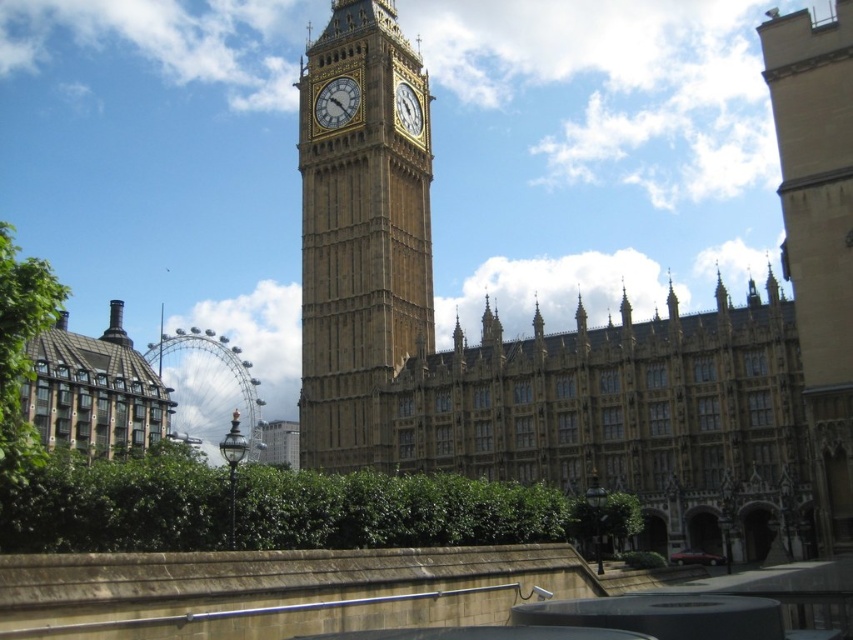
Question: Considering the real-world distances, which object is closest to the golden stone clock tower at center?

Choices:
 (A) yellow stone building at center
 (B) gold stone clock at center
 (C) gold textured clock at center

Answer: (B)

Question: Based on their relative distances, which object is nearer to the gold textured clock at center?

Choices:
 (A) gold stone clock at center
 (B) golden stone clock tower at center
 (C) yellow stone building at center
 (D) green textured building at lower left

Answer: (A)

Question: Is yellow stone building at center smaller than gold textured clock at center?

Choices:
 (A) yes
 (B) no

Answer: (B)

Question: Which point appears farthest from the camera in this image?

Choices:
 (A) (575, 374)
 (B) (41, 332)
 (C) (306, 230)
 (D) (329, 90)

Answer: (D)

Question: Does gold textured clock at center have a greater width compared to gold stone clock at center?

Choices:
 (A) yes
 (B) no

Answer: (B)

Question: Does green textured building at lower left have a larger size compared to gold stone clock at center?

Choices:
 (A) yes
 (B) no

Answer: (A)